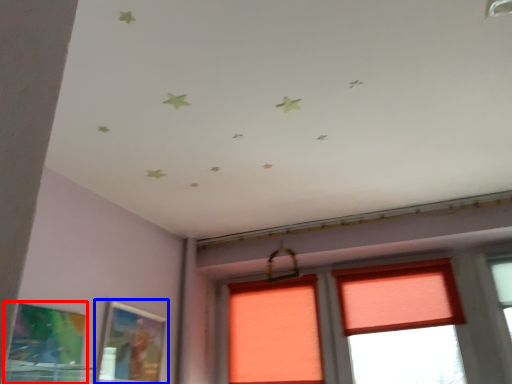
Question: Which of the following is the farthest to the observer, picture frame (highlighted by a red box) or picture frame (highlighted by a blue box)?

Choices:
 (A) picture frame
 (B) picture frame

Answer: (B)